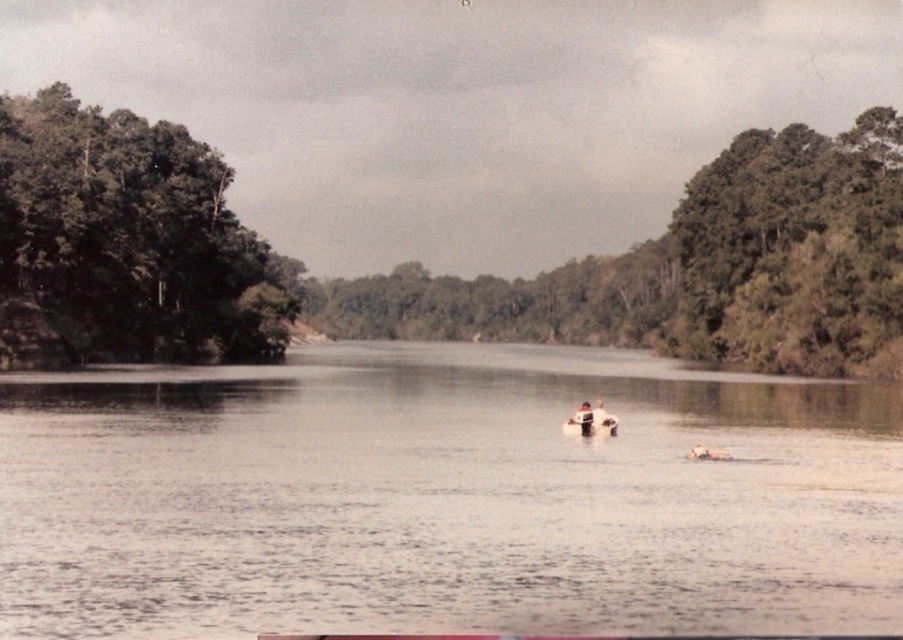
Does green leafy trees at center have a greater width compared to smooth white surfboard at center?

Indeed, green leafy trees at center has a greater width compared to smooth white surfboard at center.

Which is above, green leafy trees at center or smooth white surfboard at center?

green leafy trees at center is higher up.

Is point (811, 257) positioned after point (602, 406)?

Yes, it is behind point (602, 406).

Image resolution: width=903 pixels, height=640 pixels. I want to click on green leafy trees at center, so click(x=699, y=268).

Can you confirm if green leafy trees at center is wider than green leafy trees at left?

Yes, green leafy trees at center is wider than green leafy trees at left.

How far apart are green leafy trees at center and green leafy trees at left?

A distance of 119.42 feet exists between green leafy trees at center and green leafy trees at left.

This screenshot has width=903, height=640. What do you see at coordinates (699, 268) in the screenshot?
I see `green leafy trees at center` at bounding box center [699, 268].

You are a GUI agent. You are given a task and a screenshot of the screen. Output one action in this format:
    pyautogui.click(x=<x>, y=<y>)
    Task: Click on the green leafy trees at center
    
    Given the screenshot: What is the action you would take?
    [699, 268]

Is green leafy trees at left closer to the viewer compared to green leafy tree at right?

Yes, it is.

Is point (6, 236) positioned behind point (798, 240)?

No, it is not.

This screenshot has width=903, height=640. Find the location of `green leafy trees at left`. green leafy trees at left is located at coordinates (128, 243).